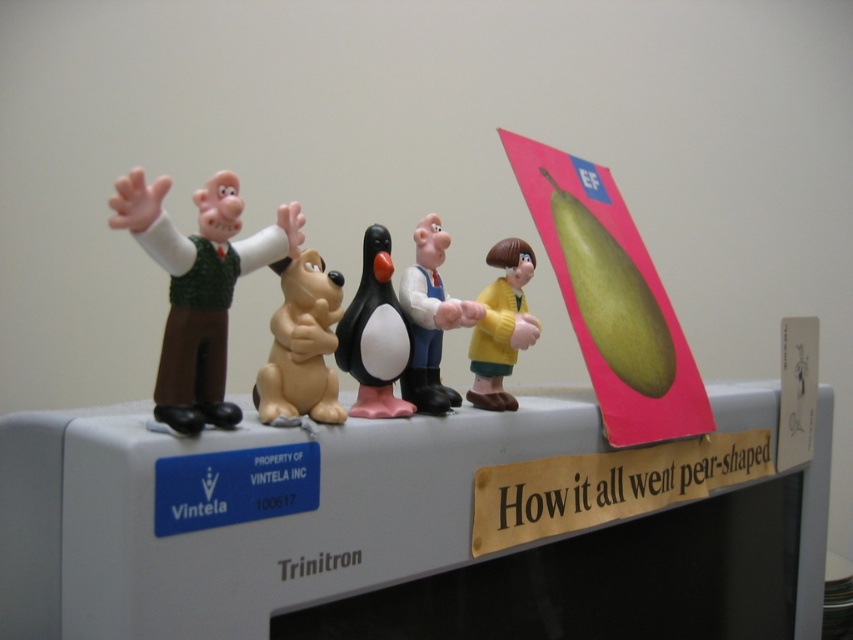
You are standing 25 inches away from the vintage Trinitron TV set. You want to pick up the figurine located at point [387,326]. Can you reach it without moving closer to the TV?

The distance of point [387,326] from the camera is 24.69 inches. Since you are standing 25 inches away, you can reach it without moving closer.